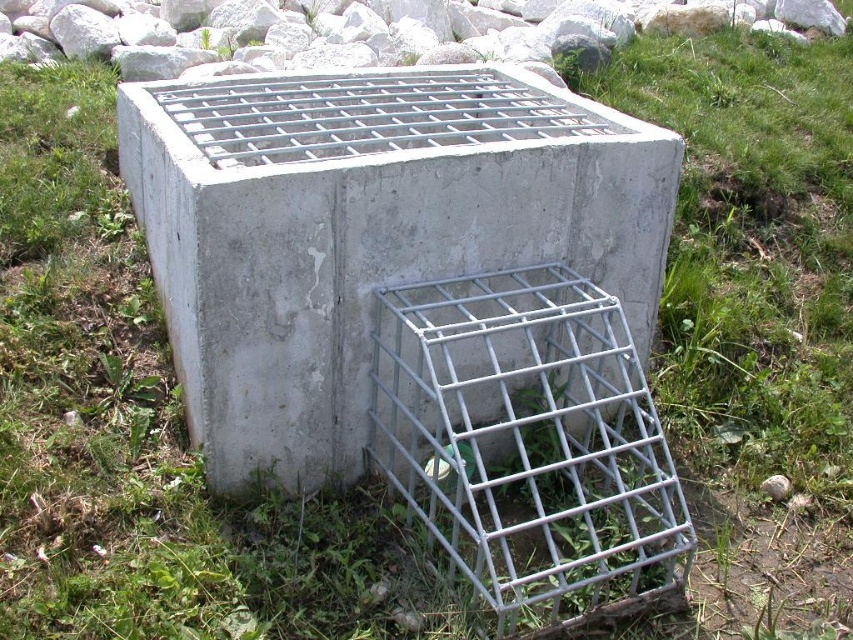
Question: Can you confirm if gray concrete block at center is positioned to the left of galvanized metal bird cage at center?

Choices:
 (A) yes
 (B) no

Answer: (A)

Question: Which object is farther from the camera taking this photo?

Choices:
 (A) gray concrete block at center
 (B) galvanized metal bird cage at center

Answer: (A)

Question: Can you confirm if gray concrete block at center is wider than galvanized metal bird cage at center?

Choices:
 (A) yes
 (B) no

Answer: (A)

Question: From the image, what is the correct spatial relationship of gray concrete block at center in relation to galvanized metal bird cage at center?

Choices:
 (A) below
 (B) above

Answer: (B)

Question: Which of the following is the closest to the observer?

Choices:
 (A) galvanized metal bird cage at center
 (B) gray concrete block at center

Answer: (A)

Question: Which of the following is the farthest from the observer?

Choices:
 (A) galvanized metal bird cage at center
 (B) gray concrete block at center

Answer: (B)